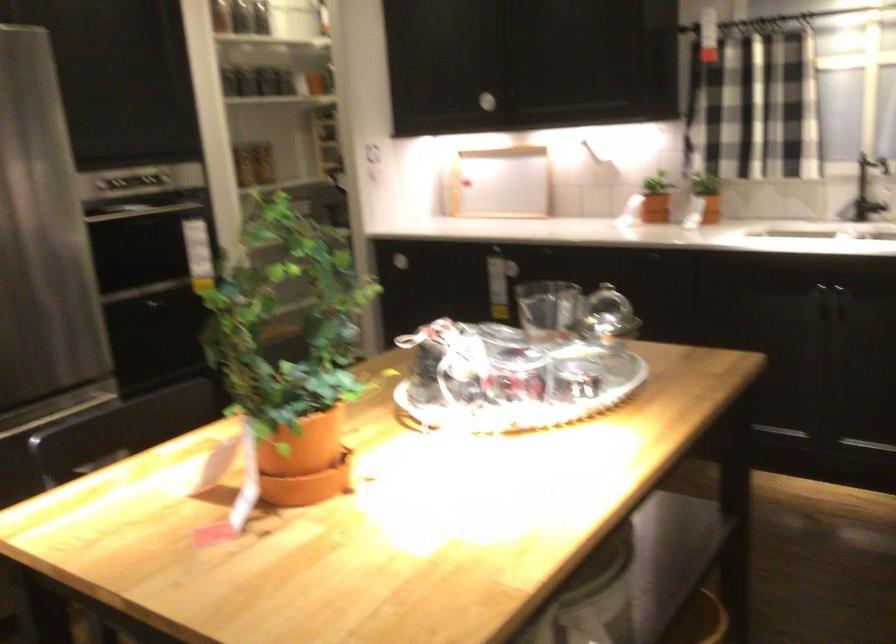
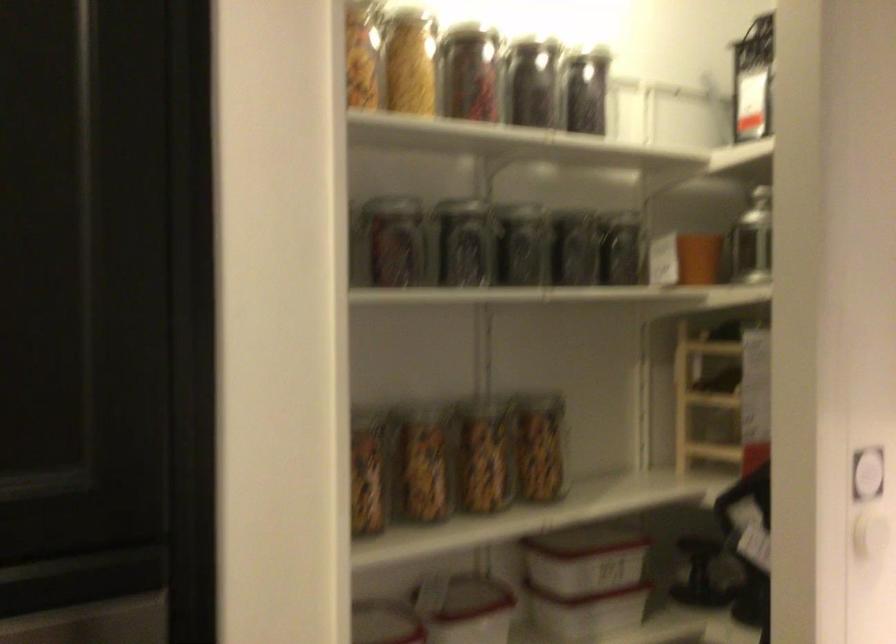
In the second image, find the point that corresponds to point 331,205 in the first image.

(700, 574)